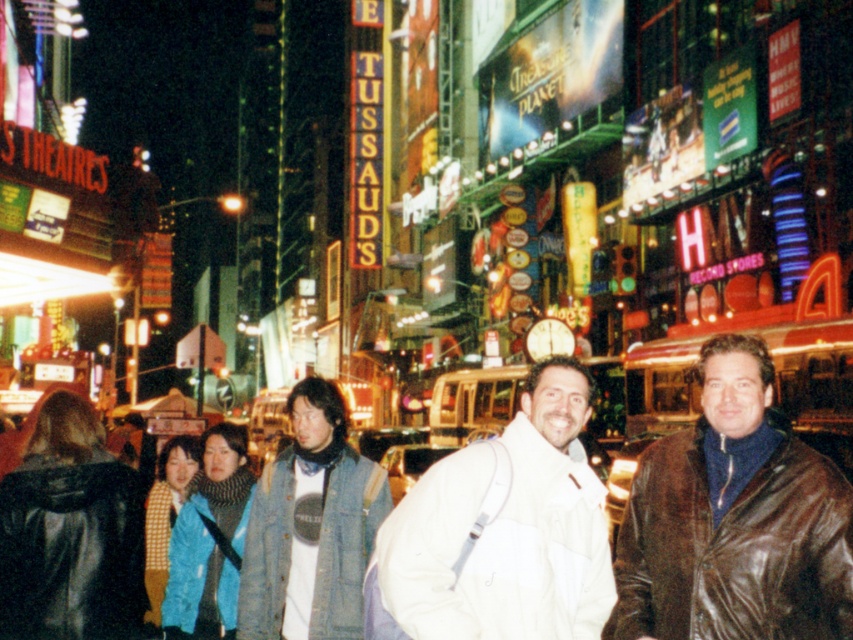
Can you confirm if white matte jacket at center is wider than denim jacket at center?

Yes.

Does white matte jacket at center have a greater height compared to denim jacket at center?

Incorrect, white matte jacket at center's height is not larger of denim jacket at center's.

Who is more distant from viewer, (521,484) or (363,470)?

The point (363,470) is more distant.

The height and width of the screenshot is (640, 853). Identify the location of white matte jacket at center. pyautogui.click(x=502, y=531).

Can you confirm if brown leather jacket at center is smaller than white matte jacket at center?

No.

What do you see at coordinates (734, 520) in the screenshot? The image size is (853, 640). I see `brown leather jacket at center` at bounding box center [734, 520].

Does point (714, 528) come closer to viewer compared to point (451, 563)?

Yes, point (714, 528) is closer to viewer.

Image resolution: width=853 pixels, height=640 pixels. I want to click on brown leather jacket at center, so 734,520.

Which is more to the right, brown leather jacket at center or denim jacket at center?

brown leather jacket at center

Which of these two, brown leather jacket at center or denim jacket at center, stands shorter?

denim jacket at center

Identify the location of brown leather jacket at center. (734, 520).